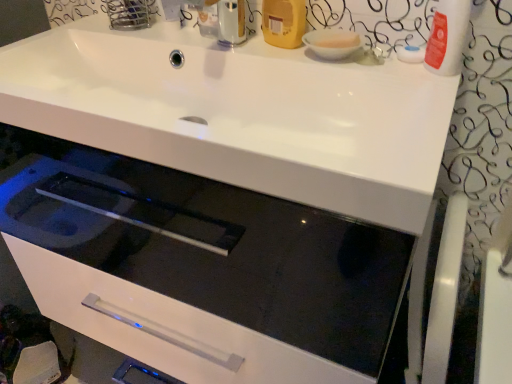
Question: Is yellow matte plastic bottle at upper right far away from white ceramic bowl at upper right?

Choices:
 (A) no
 (B) yes

Answer: (A)

Question: Is yellow matte plastic bottle at upper right next to white ceramic bowl at upper right and touching it?

Choices:
 (A) no
 (B) yes

Answer: (B)

Question: From a real-world perspective, is yellow matte plastic bottle at upper right physically below white ceramic bowl at upper right?

Choices:
 (A) no
 (B) yes

Answer: (A)

Question: From the image's perspective, would you say yellow matte plastic bottle at upper right is shown under white ceramic bowl at upper right?

Choices:
 (A) yes
 (B) no

Answer: (B)

Question: Is white ceramic bowl at upper right at the back of yellow matte plastic bottle at upper right?

Choices:
 (A) no
 (B) yes

Answer: (A)

Question: Considering the relative sizes of yellow matte plastic bottle at upper right and white ceramic bowl at upper right in the image provided, is yellow matte plastic bottle at upper right taller than white ceramic bowl at upper right?

Choices:
 (A) yes
 (B) no

Answer: (A)

Question: Is white ceramic bowl at upper right to the right of yellow matte plastic bottle at upper right from the viewer's perspective?

Choices:
 (A) no
 (B) yes

Answer: (B)

Question: Considering the relative sizes of white ceramic bowl at upper right and yellow matte plastic bottle at upper right in the image provided, is white ceramic bowl at upper right bigger than yellow matte plastic bottle at upper right?

Choices:
 (A) yes
 (B) no

Answer: (B)

Question: From a real-world perspective, is white ceramic bowl at upper right beneath yellow matte plastic bottle at upper right?

Choices:
 (A) no
 (B) yes

Answer: (B)

Question: Is white ceramic bowl at upper right aimed at yellow matte plastic bottle at upper right?

Choices:
 (A) yes
 (B) no

Answer: (B)

Question: Does white ceramic bowl at upper right contain yellow matte plastic bottle at upper right?

Choices:
 (A) yes
 (B) no

Answer: (B)

Question: Is white ceramic bowl at upper right positioned with its back to yellow matte plastic bottle at upper right?

Choices:
 (A) yes
 (B) no

Answer: (B)

Question: Visually, is white ceramic bowl at upper right positioned to the left or to the right of yellow matte plastic bottle at upper right?

Choices:
 (A) left
 (B) right

Answer: (B)